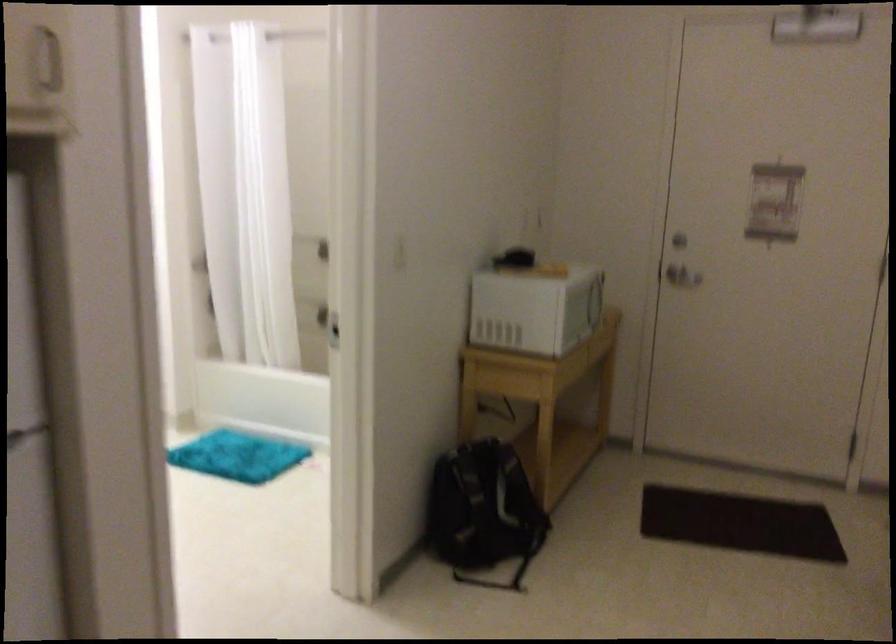
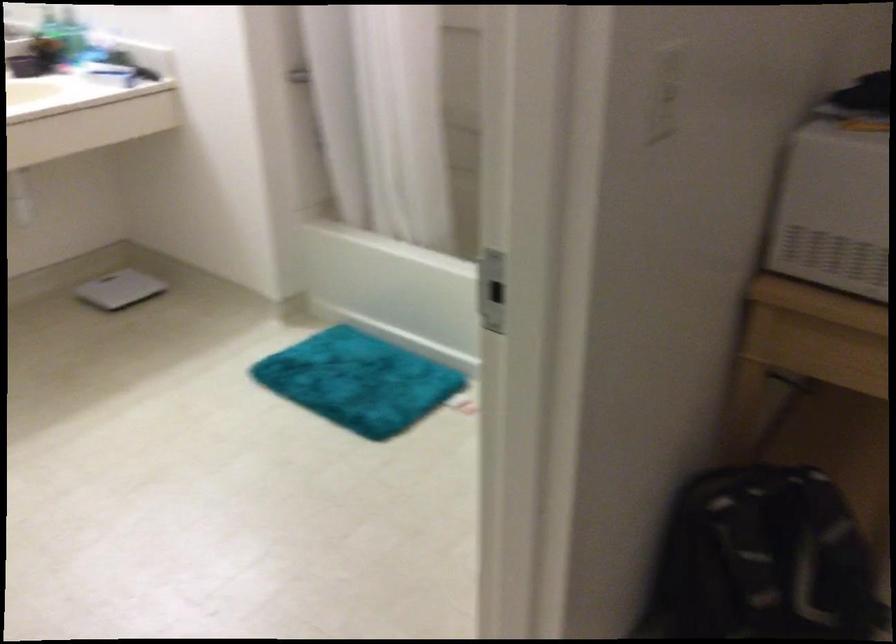
Where in the second image is the point corresponding to point (240, 455) from the first image?

(358, 381)